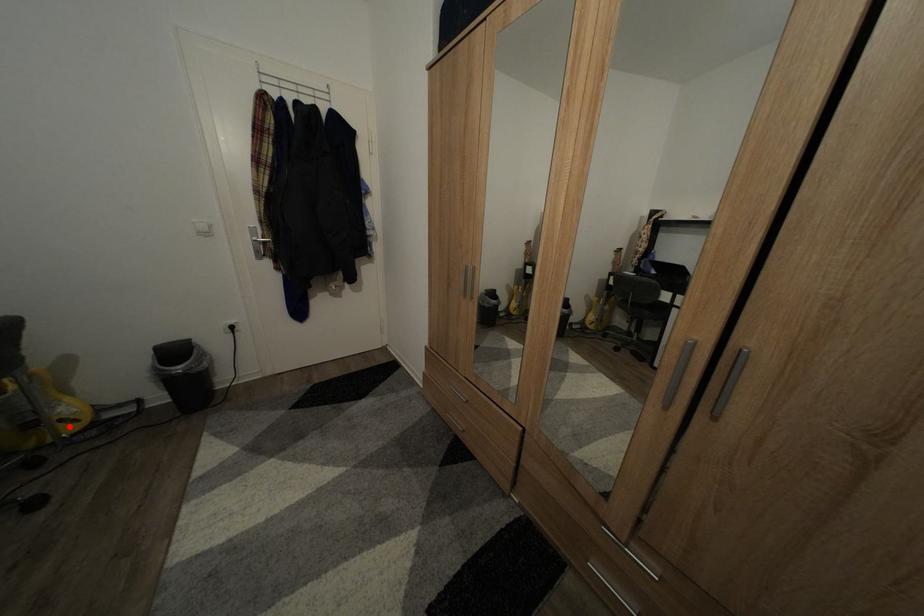
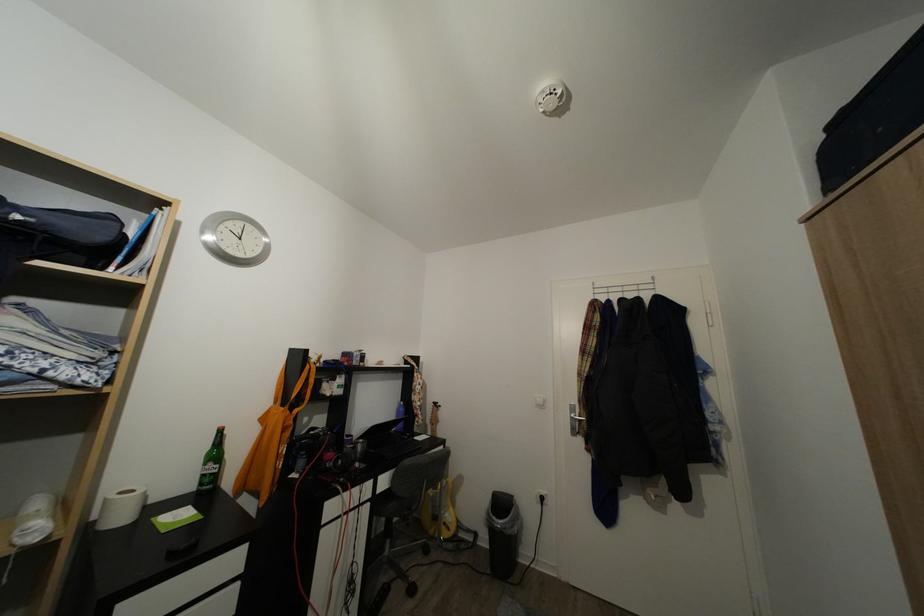
Find the pixel in the second image that matches the highlighted location in the first image.

(453, 531)